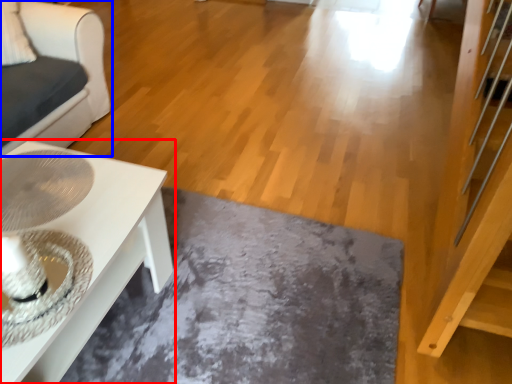
Question: Which object appears closest to the camera in this image, table (highlighted by a red box) or furniture (highlighted by a blue box)?

Choices:
 (A) table
 (B) furniture

Answer: (A)